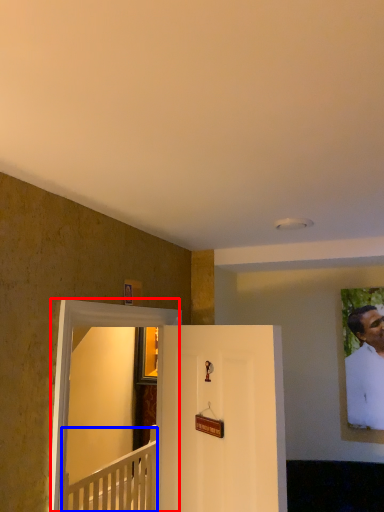
Question: Among these objects, which one is farthest to the camera, glass door (highlighted by a red box) or furniture (highlighted by a blue box)?

Choices:
 (A) glass door
 (B) furniture

Answer: (B)